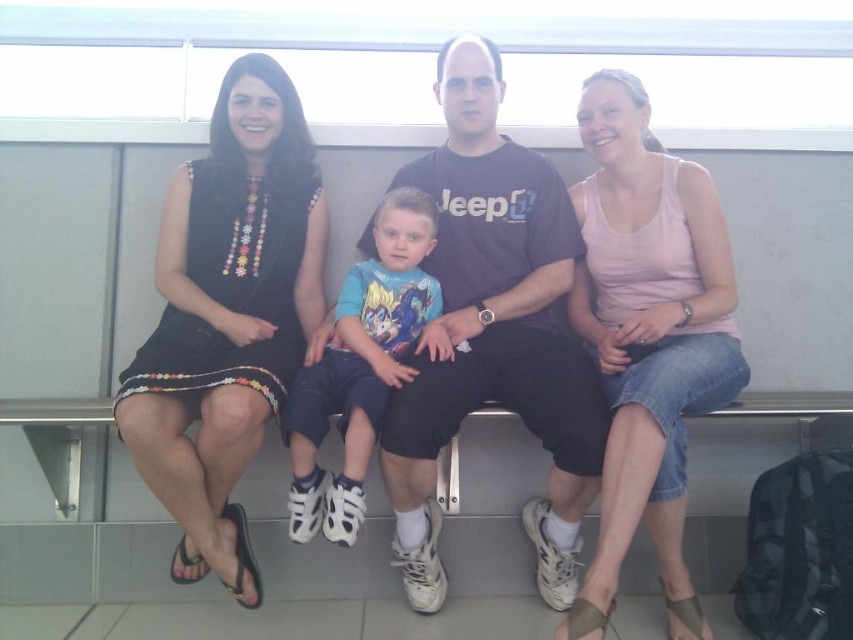
Is point (558, 636) positioned in front of point (335, 481)?

Yes, point (558, 636) is closer to viewer.

The image size is (853, 640). I want to click on pink cotton tank top at center, so click(647, 337).

Which of these two, black fabric dress at left or black cotton t-shirt at center, stands shorter?

Standing shorter between the two is black fabric dress at left.

Find the location of a particular element. The height and width of the screenshot is (640, 853). black fabric dress at left is located at coordinates (227, 316).

Locate an element on the screen. The image size is (853, 640). matte black dress at left is located at coordinates (569, 333).

Is matte black dress at left to the left of blue cotton shirt at center from the viewer's perspective?

In fact, matte black dress at left is to the right of blue cotton shirt at center.

Does point (602, 268) come behind point (288, 406)?

Yes, point (602, 268) is behind point (288, 406).

Image resolution: width=853 pixels, height=640 pixels. Find the location of `matte black dress at left`. matte black dress at left is located at coordinates (569, 333).